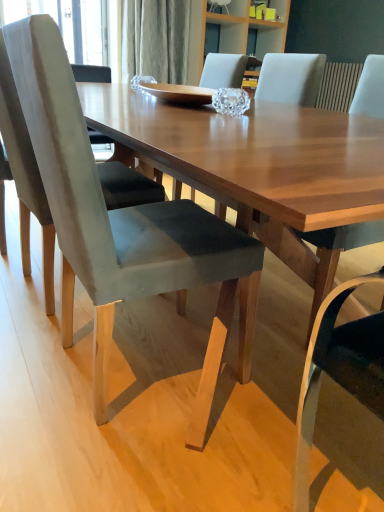
Question: Is suede gray chair at left, positioned as the first chair in left-to-right order, in front of or behind velvet gray chair at center, positioned as the 2th chair in left-to-right order, in the image?

Choices:
 (A) front
 (B) behind

Answer: (B)

Question: Considering the positions of suede gray chair at left, positioned as the first chair in left-to-right order, and velvet gray chair at center, marked as the 2th chair in a right-to-left arrangement, in the image, is suede gray chair at left, positioned as the first chair in left-to-right order, wider or thinner than velvet gray chair at center, marked as the 2th chair in a right-to-left arrangement,?

Choices:
 (A) wide
 (B) thin

Answer: (A)

Question: Which of these objects is positioned farthest from the suede gray chair at left, the 3th chair from the right?

Choices:
 (A) velvet gray chair at center, positioned as the 2th chair in left-to-right order
 (B) matte gray chair at center, which is the first chair in right-to-left order

Answer: (B)

Question: Based on their relative distances, which object is farther from the suede gray chair at left, positioned as the first chair in left-to-right order?

Choices:
 (A) matte gray chair at center, the third chair when ordered from left to right
 (B) velvet gray chair at center, positioned as the 2th chair in left-to-right order

Answer: (A)